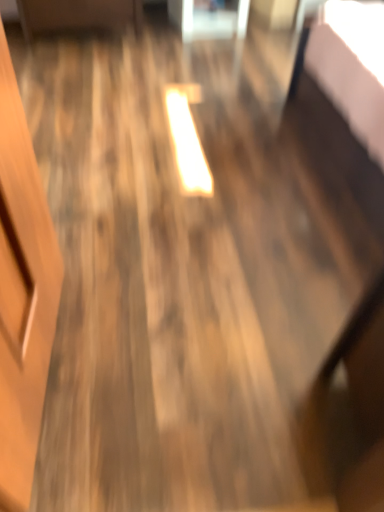
You are a GUI agent. You are given a task and a screenshot of the screen. Output one action in this format:
    pyautogui.click(x=<x>, y=<y>)
    Task: Click on the unoccupied area behind wooden door at left
    The height and width of the screenshot is (512, 384).
    Given the screenshot: What is the action you would take?
    pyautogui.click(x=122, y=263)